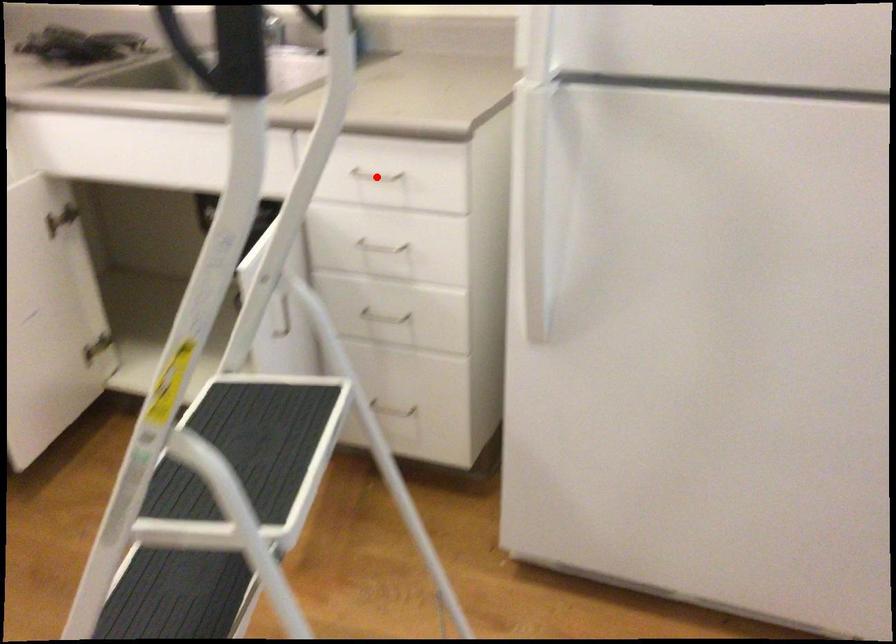
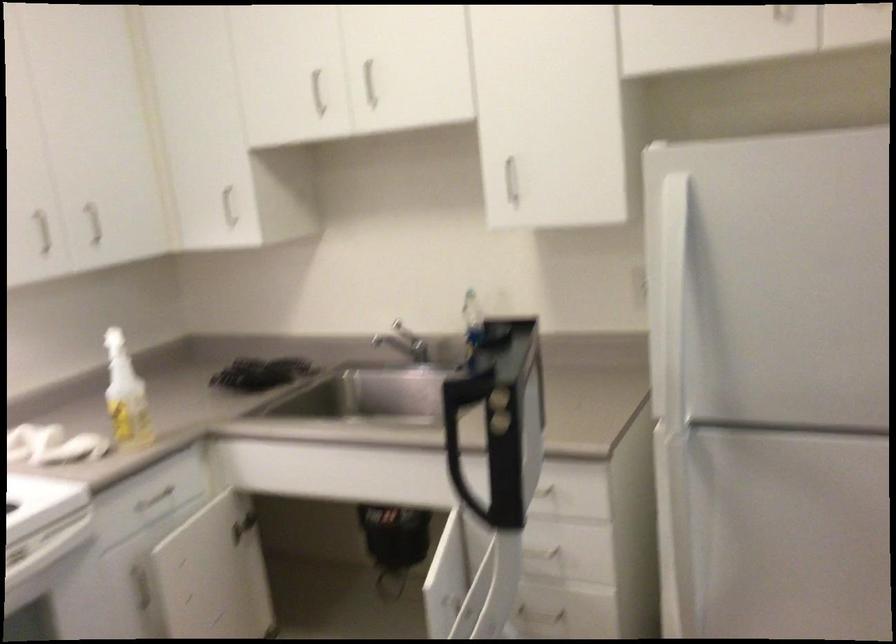
Question: I am providing you with two images of the same scene from different viewpoints. A red point is marked on the first image. Can you still see the location of the red point in image 2?

Choices:
 (A) Yes
 (B) No

Answer: (B)